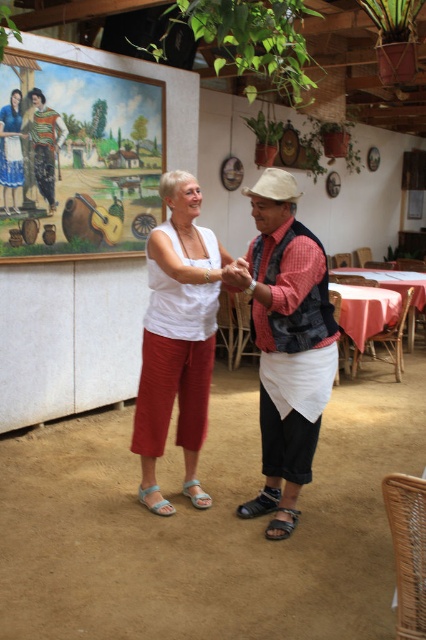
You are a customer at the restaurant and want to choose between the brown leather sandal at lower center and the light gray fabric sandal at lower left. Which sandal is wider?

The brown leather sandal at lower center is wider than the light gray fabric sandal at lower left.

You are standing in the middle of the room. There is a point marked at coordinates (196,493). What object is located at that point?

The point at (196,493) marks the light gray fabric sandal at lower left.